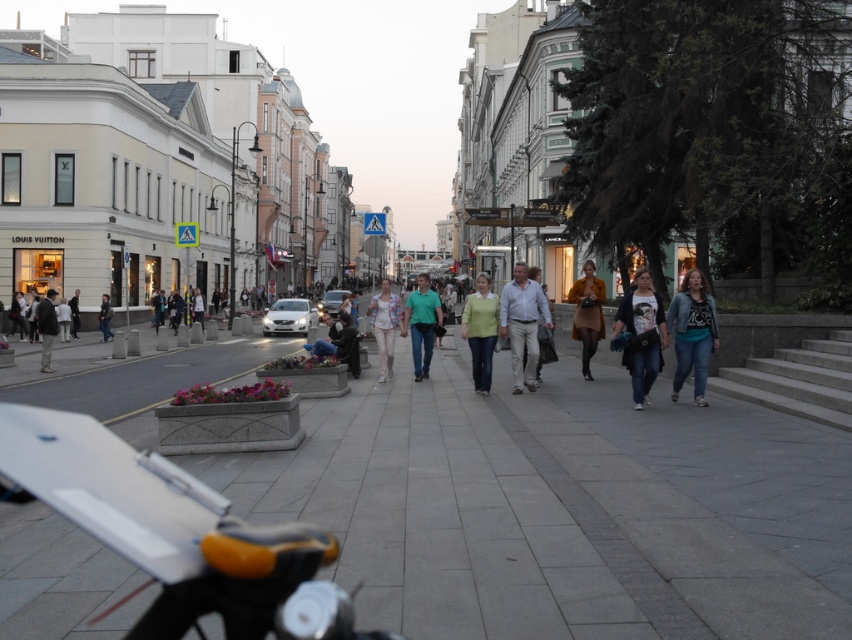
Question: Does matte yellow coat at center appear on the left side of dark gray suit at left?

Choices:
 (A) yes
 (B) no

Answer: (B)

Question: Which object appears farthest from the camera in this image?

Choices:
 (A) gray concrete pavement at center
 (B) dark brown leather jacket at center
 (C) green matte shirt at center
 (D) matte black jacket at right

Answer: (B)

Question: Which point is closer to the camera?

Choices:
 (A) matte black jacket at right
 (B) denim jacket at lower right

Answer: (A)

Question: Estimate the real-world distances between objects in this image. Which object is farther from the matte yellow coat at center?

Choices:
 (A) light beige cotton shirt at center
 (B) matte black jacket at right

Answer: (B)

Question: Can you confirm if gray concrete pavement at center is bigger than denim jacket at lower right?

Choices:
 (A) yes
 (B) no

Answer: (A)

Question: Can you confirm if denim jacket at lower right is positioned below matte black jacket at right?

Choices:
 (A) yes
 (B) no

Answer: (B)